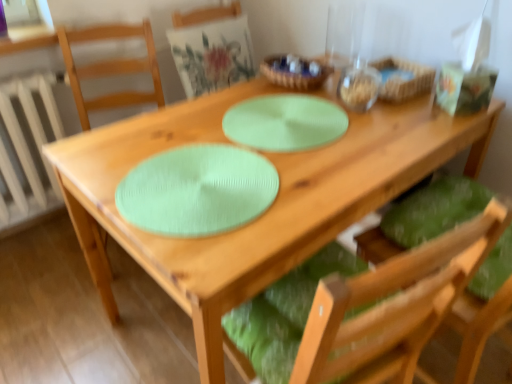
Question: Is mint green textured placemat at center aimed at woven wood basket at upper right?

Choices:
 (A) no
 (B) yes

Answer: (A)

Question: Is mint green textured placemat at center facing away from woven wood basket at upper right?

Choices:
 (A) yes
 (B) no

Answer: (B)

Question: From a real-world perspective, is mint green textured placemat at center physically above woven wood basket at upper right?

Choices:
 (A) yes
 (B) no

Answer: (B)

Question: Are mint green textured placemat at center and woven wood basket at upper right making contact?

Choices:
 (A) no
 (B) yes

Answer: (A)

Question: Does mint green textured placemat at center have a larger size compared to woven wood basket at upper right?

Choices:
 (A) no
 (B) yes

Answer: (A)

Question: Is mint green textured placemat at center spatially inside green fabric cushion at lower right, which appears as the first chair when viewed from the right, or outside of it?

Choices:
 (A) outside
 (B) inside

Answer: (A)

Question: From a real-world perspective, is mint green textured placemat at center positioned above or below green fabric cushion at lower right, which appears as the first chair when viewed from the right?

Choices:
 (A) above
 (B) below

Answer: (A)

Question: Considering their positions, is mint green textured placemat at center located in front of or behind green fabric cushion at lower right, which appears as the first chair when viewed from the right?

Choices:
 (A) behind
 (B) front

Answer: (A)

Question: Is mint green textured placemat at center wider or thinner than green fabric cushion at lower right, which appears as the first chair when viewed from the right?

Choices:
 (A) wide
 (B) thin

Answer: (B)

Question: Would you say matte green cushion at upper center, the 3th chair from the right, is inside or outside white painted metal radiator at left?

Choices:
 (A) inside
 (B) outside

Answer: (B)

Question: Visually, is matte green cushion at upper center, the 1th chair positioned from the left, positioned to the left or to the right of white painted metal radiator at left?

Choices:
 (A) left
 (B) right

Answer: (B)

Question: From the image's perspective, is matte green cushion at upper center, the 1th chair positioned from the left, located above or below white painted metal radiator at left?

Choices:
 (A) below
 (B) above

Answer: (B)

Question: Is matte green cushion at upper center, the 3th chair from the right, bigger or smaller than white painted metal radiator at left?

Choices:
 (A) big
 (B) small

Answer: (B)

Question: Would you say wooden bowl at upper center is inside or outside green fabric cushion at center, the second chair when ordered from left to right?

Choices:
 (A) inside
 (B) outside

Answer: (B)

Question: Based on their positions, is wooden bowl at upper center located to the left or right of green fabric cushion at center, the second chair when ordered from left to right?

Choices:
 (A) right
 (B) left

Answer: (A)